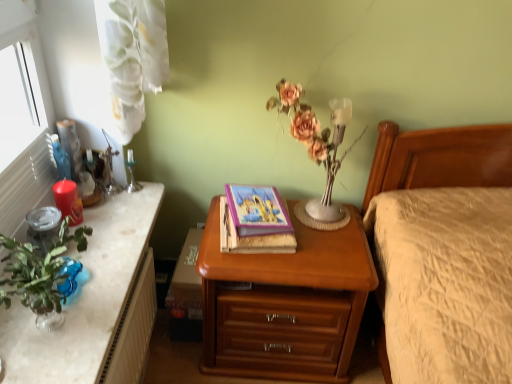
I want to click on white textured radiator at lower left, so click(x=133, y=330).

What is the approximate width of silver metallic candle holder at upper left?

silver metallic candle holder at upper left is 5.15 centimeters in width.

Where is `matte red candle at left`? This screenshot has height=384, width=512. matte red candle at left is located at coordinates (68, 201).

Where is `matte pink flowers at center`? matte pink flowers at center is located at coordinates (317, 151).

At what (x,y) coordinates should I click in order to perform the action: click on matte purple book at center. Please return your answer as a coordinate pair (x, y). This screenshot has height=384, width=512. Looking at the image, I should click on (257, 210).

At what (x,y) coordinates should I click in order to perform the action: click on white textured radiator at lower left. Please return your answer as a coordinate pair (x, y). The height and width of the screenshot is (384, 512). Looking at the image, I should click on (133, 330).

Is wooden nightstand at center wider than green marble desk at left?

Correct, the width of wooden nightstand at center exceeds that of green marble desk at left.

Looking at this image, is wooden nightstand at center behind green marble desk at left?

Yes, wooden nightstand at center is further from the viewer.

Is wooden nightstand at center next to green marble desk at left?

No, wooden nightstand at center is not making contact with green marble desk at left.

How many degrees apart are the facing directions of wooden nightstand at center and green marble desk at left?

They differ by 91.4 degrees in their facing directions.

Is the surface of wooden nightstand at center in direct contact with matte purple book at center?

No, wooden nightstand at center is not making contact with matte purple book at center.

Is point (335, 358) behind point (249, 200)?

Yes, point (335, 358) is farther from viewer.

Is white textured radiator at lower left in front of matte red candle at left?

Yes, white textured radiator at lower left is closer to the viewer.

Which is further, (138,280) or (82,211)?

Positioned behind is point (82,211).

Can you confirm if white textured radiator at lower left is taller than matte red candle at left?

Correct, white textured radiator at lower left is much taller as matte red candle at left.

Do you think white textured radiator at lower left is within matte red candle at left, or outside of it?

white textured radiator at lower left is outside matte red candle at left.

Which is behind, point (153, 261) or point (30, 362)?

Point (153, 261)

Which of these two, white textured radiator at lower left or green marble desk at left, is wider?

Wider between the two is green marble desk at left.

Is white textured radiator at lower left taller or shorter than green marble desk at left?

In the image, white textured radiator at lower left appears to be taller than green marble desk at left.

From a real-world perspective, relative to matte pink flowers at center, is matte red candle at left vertically above or below?

In terms of real-world spatial position, matte red candle at left is below matte pink flowers at center.

Can you confirm if matte red candle at left is wider than matte pink flowers at center?

No.

Considering the sizes of objects matte red candle at left and matte pink flowers at center in the image provided, who is smaller, matte red candle at left or matte pink flowers at center?

matte red candle at left.

Does matte red candle at left contain matte pink flowers at center?

No, matte pink flowers at center is located outside of matte red candle at left.

Is green marble desk at left to the right of silver metallic candle holder at upper left from the viewer's perspective?

No.

From a real-world perspective, is green marble desk at left physically located above or below silver metallic candle holder at upper left?

green marble desk at left is situated lower than silver metallic candle holder at upper left in the real world.

From the image's perspective, is green marble desk at left located above silver metallic candle holder at upper left?

No, from the image's perspective, green marble desk at left is not over silver metallic candle holder at upper left.

Could you tell me if green marble desk at left is facing silver metallic candle holder at upper left?

No, green marble desk at left is not turned towards silver metallic candle holder at upper left.

Locate an element on the screen. candle holder on the right of matte red candle at left is located at coordinates (132, 173).

Does silver metallic candle holder at upper left have a greater height compared to matte red candle at left?

In fact, silver metallic candle holder at upper left may be shorter than matte red candle at left.

Does silver metallic candle holder at upper left come in front of matte red candle at left?

No, it is behind matte red candle at left.

Is silver metallic candle holder at upper left oriented towards matte red candle at left?

No, silver metallic candle holder at upper left is not aimed at matte red candle at left.

Where is `desk above the wooden nightstand at center (from a real-world perspective)`? Image resolution: width=512 pixels, height=384 pixels. desk above the wooden nightstand at center (from a real-world perspective) is located at coordinates (83, 298).

At what (x,y) coordinates should I click in order to perform the action: click on nightstand located in front of the matte purple book at center. Please return your answer as a coordinate pair (x, y). Looking at the image, I should click on (285, 304).

Based on their spatial positions, is matte red candle at left or matte purple book at center closer to green marble desk at left?

matte red candle at left lies closer to green marble desk at left than the other object.

Based on their spatial positions, is silver metallic candle holder at upper left or wooden nightstand at center closer to matte purple book at center?

wooden nightstand at center is positioned closer to the anchor matte purple book at center.

From the image, which object appears to be farther from green marble desk at left, white textured radiator at lower left or matte pink flowers at center?

matte pink flowers at center is positioned further to the anchor green marble desk at left.

Considering their positions, is silver metallic candle holder at upper left positioned further to matte pink flowers at center than white textured radiator at lower left?

Based on the image, white textured radiator at lower left appears to be further to matte pink flowers at center.

From the image, which object appears to be nearer to matte red candle at left, matte purple book at center or silver metallic candle holder at upper left?

silver metallic candle holder at upper left is closer to matte red candle at left.

From the image, which object appears to be farther from matte red candle at left, matte pink flowers at center or white textured radiator at lower left?

matte pink flowers at center.

Based on the photo, when comparing their distances from silver metallic candle holder at upper left, does matte pink flowers at center or matte red candle at left seem closer?

matte red candle at left is closer to silver metallic candle holder at upper left.

Estimate the real-world distances between objects in this image. Which object is further from matte pink flowers at center, wooden nightstand at center or matte red candle at left?

matte red candle at left is positioned further to the anchor matte pink flowers at center.

The image size is (512, 384). Identify the location of radiator between silver metallic candle holder at upper left and matte pink flowers at center from left to right. (133, 330).

The height and width of the screenshot is (384, 512). Find the location of `book between green marble desk at left and wooden nightstand at center`. book between green marble desk at left and wooden nightstand at center is located at coordinates (257, 210).

The image size is (512, 384). What are the coordinates of `book located between matte red candle at left and wooden nightstand at center in the left-right direction` in the screenshot? It's located at (257, 210).

Where is `book that lies between matte pink flowers at center and white textured radiator at lower left from top to bottom`? This screenshot has height=384, width=512. book that lies between matte pink flowers at center and white textured radiator at lower left from top to bottom is located at coordinates (257, 210).